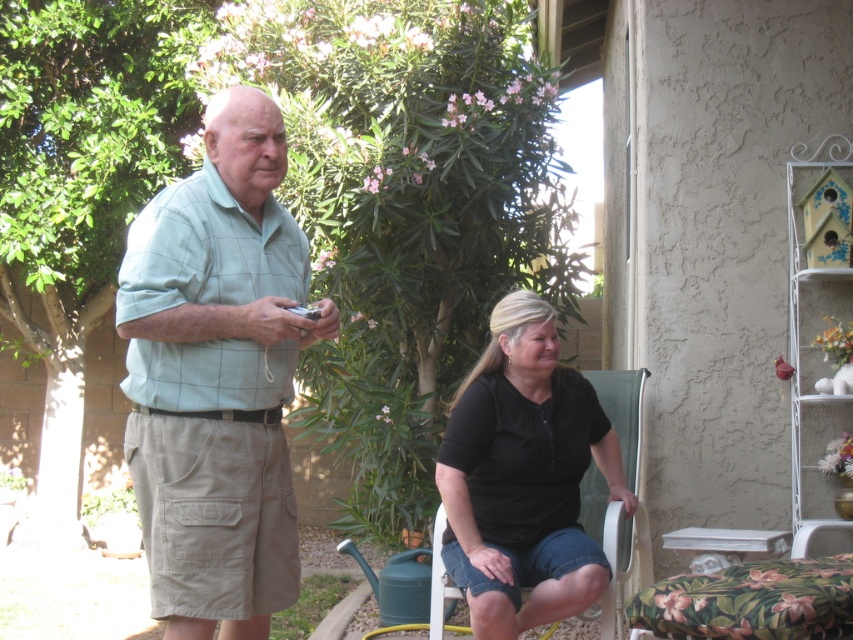
You are a photographer trying to capture a candid shot of the man holding the camera and the woman sitting on the white chair. You are standing 3 meters behind the camera. Can you fit both the green plaid shirt at center and the camera into your camera frame without moving either subject?

The green plaid shirt at center and the camera are 2.81 meters apart from each other. Since you are standing 3 meters behind the camera, the distance between the two subjects is within your camera frame range. Therefore, you can fit both the green plaid shirt at center and the camera into your camera frame without moving either subject.

You are planning to hang two shirts on a clothesline in the backyard. The clothesline has a hook at the top and can only hold one shirt at a time. You need to hang the green plaid shirt at center and the black cotton shirt at center. Which shirt should you hang first to ensure both shirts can be properly displayed without overlapping?

The green plaid shirt at center is taller than the black cotton shirt at center. To prevent overlapping, hang the taller green plaid shirt at center first at the top hook, then hang the shorter black cotton shirt at center below it so they both are visible and spaced appropriately.